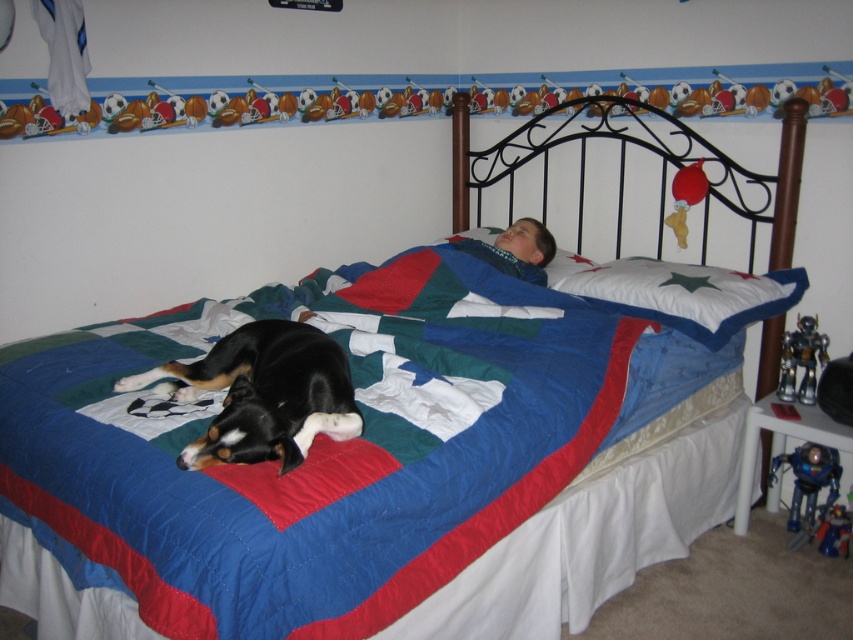
Question: Can you confirm if metallic blue robot at lower right is bigger than red rubber duck at upper right?

Choices:
 (A) no
 (B) yes

Answer: (B)

Question: Which of the following is the farthest from the observer?

Choices:
 (A) (299, 365)
 (B) (838, 554)
 (C) (799, 499)

Answer: (C)

Question: Is white soft pillow at upper right to the left of red rubber duck at upper right from the viewer's perspective?

Choices:
 (A) no
 (B) yes

Answer: (B)

Question: Among these points, which one is nearest to the camera?

Choices:
 (A) (851, 516)
 (B) (750, 292)
 (C) (685, 228)
 (D) (805, 467)

Answer: (B)

Question: Does white soft pillow at upper right have a smaller size compared to red rubber duck at upper right?

Choices:
 (A) yes
 (B) no

Answer: (B)

Question: Which object is farther from the camera taking this photo?

Choices:
 (A) black and tan plush dog at center
 (B) metallic silver robot at right
 (C) red rubber duck at upper right
 (D) metallic silver robot at lower right

Answer: (C)